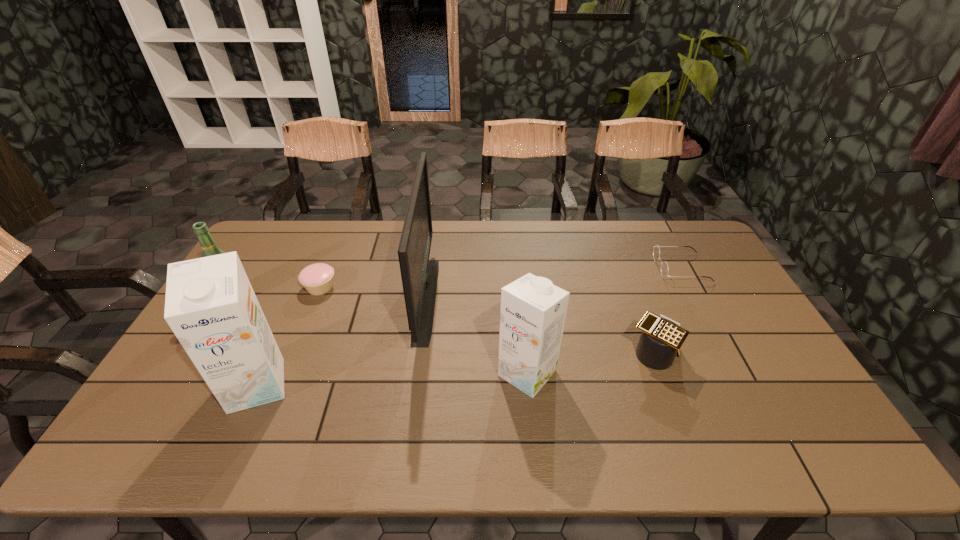
Image resolution: width=960 pixels, height=540 pixels. What are the coordinates of `monitor that is at the far edge` in the screenshot? It's located at (419, 275).

The width and height of the screenshot is (960, 540). What are the coordinates of `carton present at the left edge` in the screenshot? It's located at (210, 305).

Find the location of a particular element. This screenshot has height=540, width=960. beer bottle that is at the left edge is located at coordinates (208, 245).

At what (x,y) coordinates should I click in order to perform the action: click on object present at the right edge. Please return your answer as a coordinate pair (x, y). This screenshot has height=540, width=960. Looking at the image, I should click on (664, 269).

This screenshot has height=540, width=960. What are the coordinates of `object that is at the near left corner` in the screenshot? It's located at (210, 305).

Where is `object situated at the far right corner`? The width and height of the screenshot is (960, 540). object situated at the far right corner is located at coordinates (664, 269).

The width and height of the screenshot is (960, 540). In order to click on vacant space at the far edge of the desktop in this screenshot , I will do `click(320, 232)`.

The image size is (960, 540). I want to click on vacant region at the near edge of the desktop, so click(683, 402).

The width and height of the screenshot is (960, 540). Find the location of `vacant space at the left edge of the desktop`. vacant space at the left edge of the desktop is located at coordinates (258, 286).

Where is `vacant position at the right edge of the desktop`? The image size is (960, 540). vacant position at the right edge of the desktop is located at coordinates (734, 302).